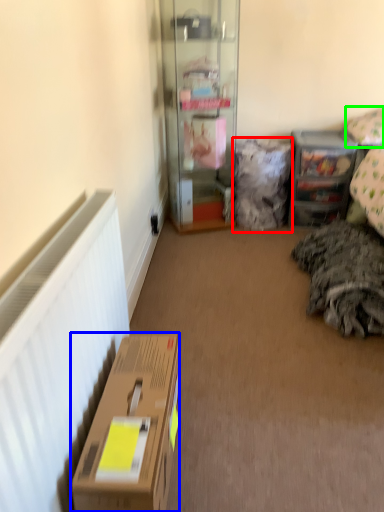
Question: Based on their relative distances, which object is farther from pillow (highlighted by a red box)? Choose from box (highlighted by a blue box) and pillow (highlighted by a green box).

Choices:
 (A) box
 (B) pillow

Answer: (A)